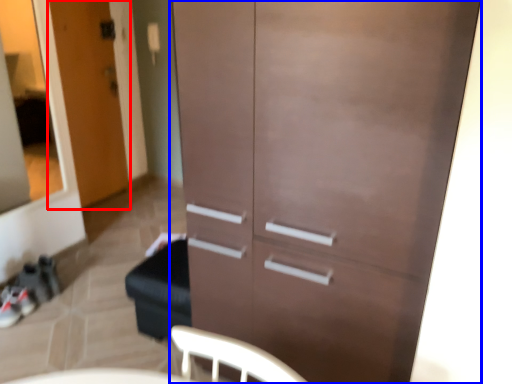
Question: Which object appears farthest to the camera in this image, door (highlighted by a red box) or cupboard (highlighted by a blue box)?

Choices:
 (A) door
 (B) cupboard

Answer: (A)